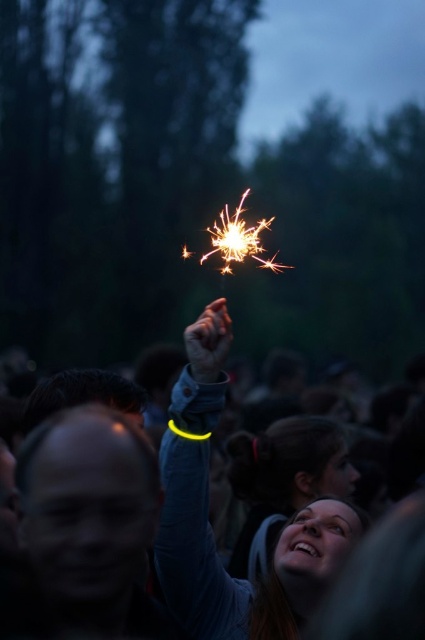
In the scene shown: You are at an event where safety is a priority. There is a point marked at coordinates (207, 518) which corresponds to a yellow glow in the dark wristband at upper center. Considering the scene described, what object is located at that point?

The point marked at coordinates (207, 518) corresponds to the yellow glow in the dark wristband at upper center.